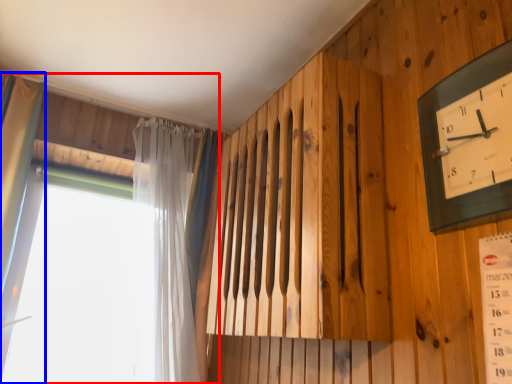
Question: Which of the following is the farthest to the observer, window (highlighted by a red box) or curtain (highlighted by a blue box)?

Choices:
 (A) window
 (B) curtain

Answer: (A)